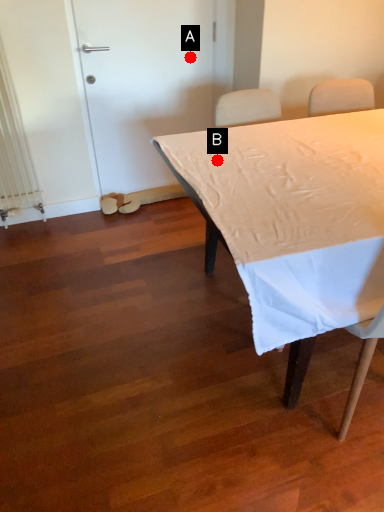
Question: Two points are circled on the image, labeled by A and B beside each circle. Which point is further to the camera?

Choices:
 (A) A is further
 (B) B is further

Answer: (A)